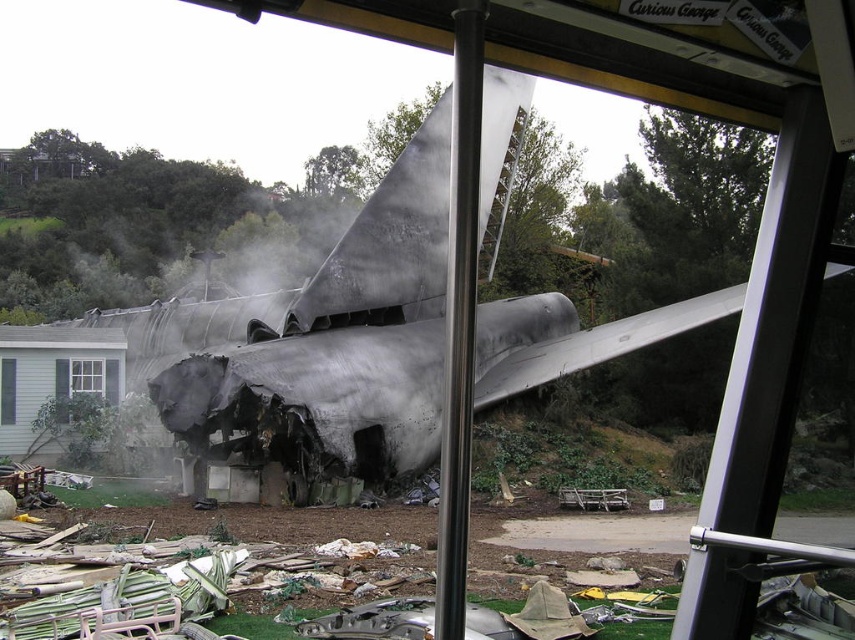
You are a rescue worker trying to navigate through the debris to reach the cockpit of the aircraft. You see the gray wood window at lower left and the white plastic window at lower left. Which window is closer to you?

The gray wood window at lower left and white plastic window at lower left are 3.01 meters apart from each other, so you need to determine which one is closer based on their positions. However, the description only provides the distance between them, not their individual distances to the observer. Without additional information about their exact locations relative to your position, it is impossible to determine which window is closer.

In the scene shown: You are an inspector assessing the damage at the crash site. You notice two windows in the debris area. The gray wood window at lower left and the white plastic window at lower left. Which window is shorter in height?

The gray wood window at lower left is shorter than the white plastic window at lower left.

You are a drone operator trying to assess the damage from above. You notice two points of interest marked as point 1 at coordinates point 1 at point (57, 392) and point 2 at point (0, 376). Which point is closer to the camera?

Point (0, 376) is closer to the camera because it is positioned behind point (57, 392), which is further away.